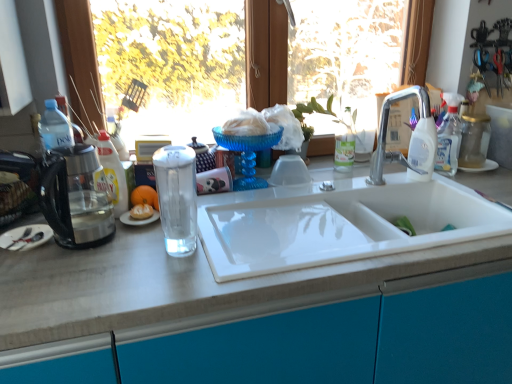
Where is `free location in front of translucent glass kettle at left`? This screenshot has height=384, width=512. free location in front of translucent glass kettle at left is located at coordinates tap(65, 281).